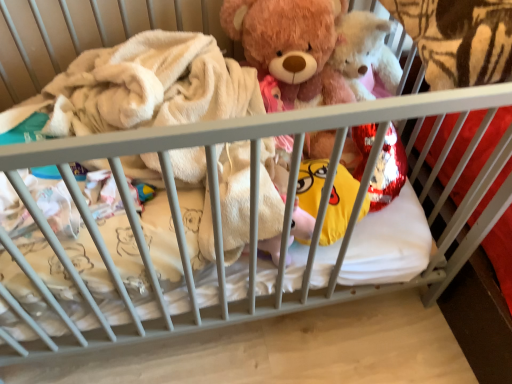
In order to face fluffy pink teddy bear at center, should I rotate leftwards or rightwards?

A 4.701 degree turn to the right will do.

This screenshot has width=512, height=384. Find the location of `fluffy pink teddy bear at center`. fluffy pink teddy bear at center is located at coordinates (291, 46).

This screenshot has height=384, width=512. Describe the element at coordinates (291, 46) in the screenshot. I see `fluffy pink teddy bear at center` at that location.

The image size is (512, 384). I want to click on fluffy pink teddy bear at center, so click(291, 46).